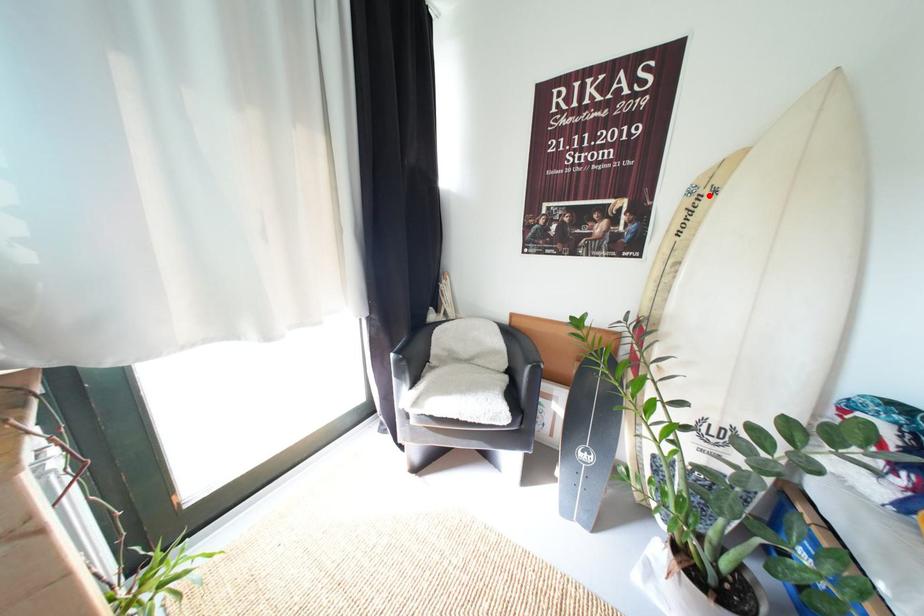
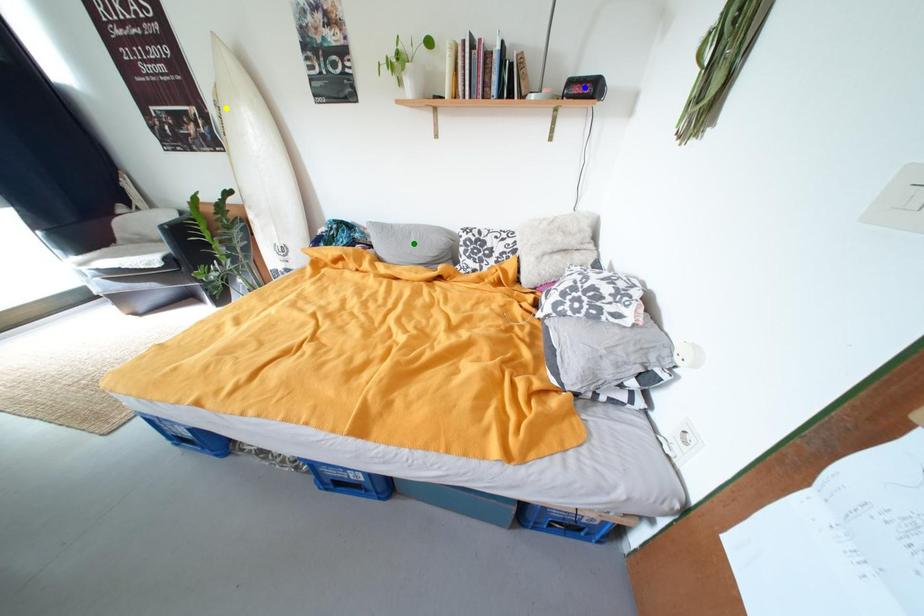
Question: I am providing you with two images of the same scene from different viewpoints. A red point is marked on the first image. You are given multiple points on the second image. Which point in image 2 is actually the same real-world point as the red point in image 1?

Choices:
 (A) yellow point
 (B) green point
 (C) blue point

Answer: (A)